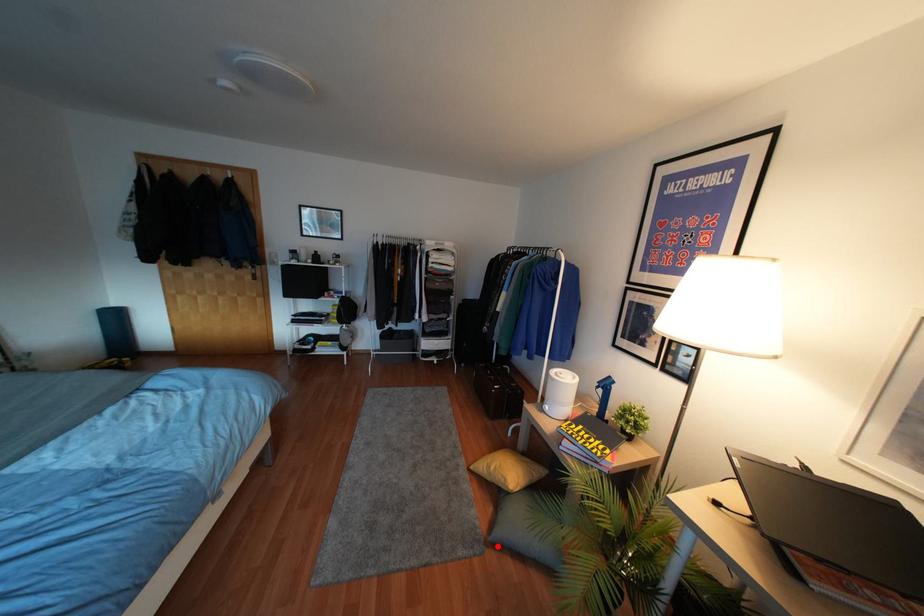
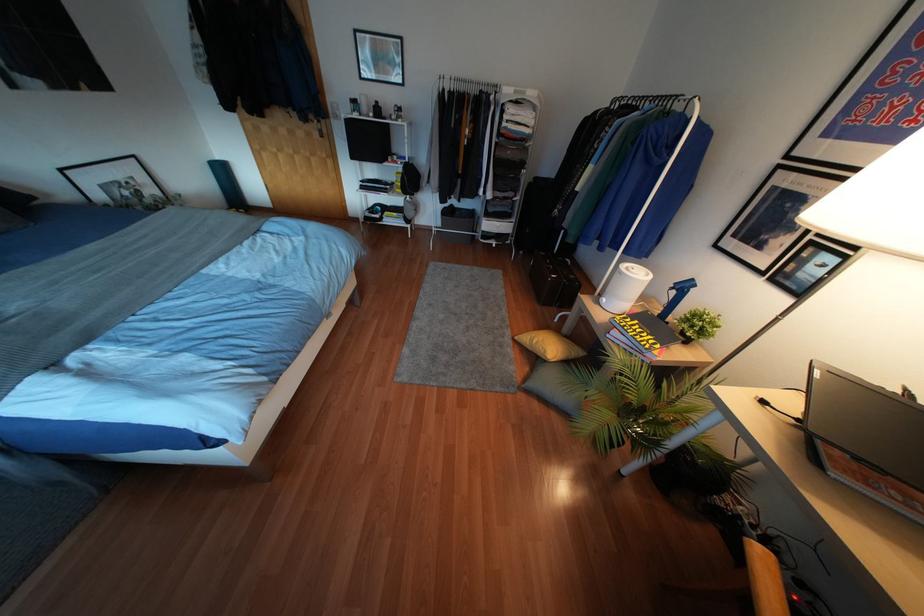
Question: I am providing you with two images of the same scene from different viewpoints. A red point is marked on the first image. At the location where the point appears in image 1, is it still visible in image 2?

Choices:
 (A) Yes
 (B) No

Answer: (A)